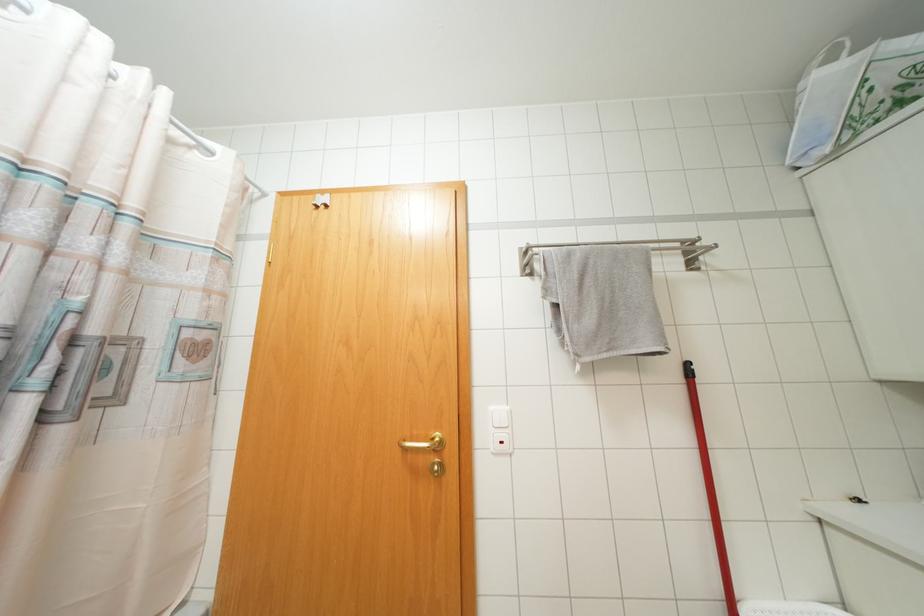
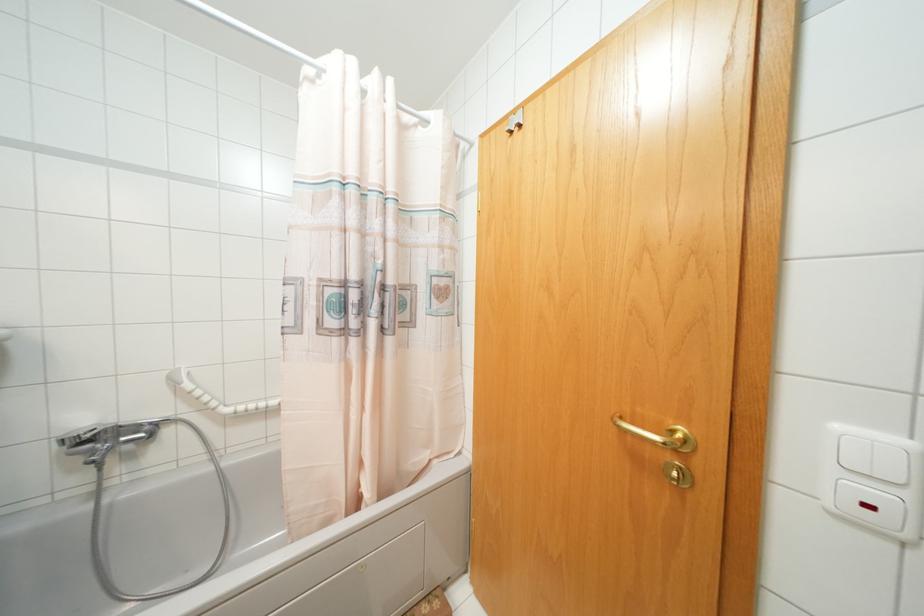
Locate, in the second image, the point that corresponds to point (506, 408) in the first image.

(906, 442)